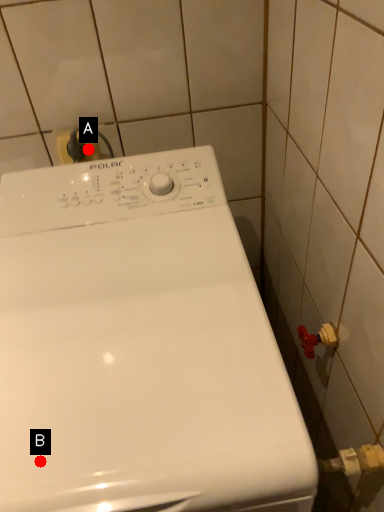
Question: Two points are circled on the image, labeled by A and B beside each circle. Which point is closer to the camera?

Choices:
 (A) A is closer
 (B) B is closer

Answer: (B)